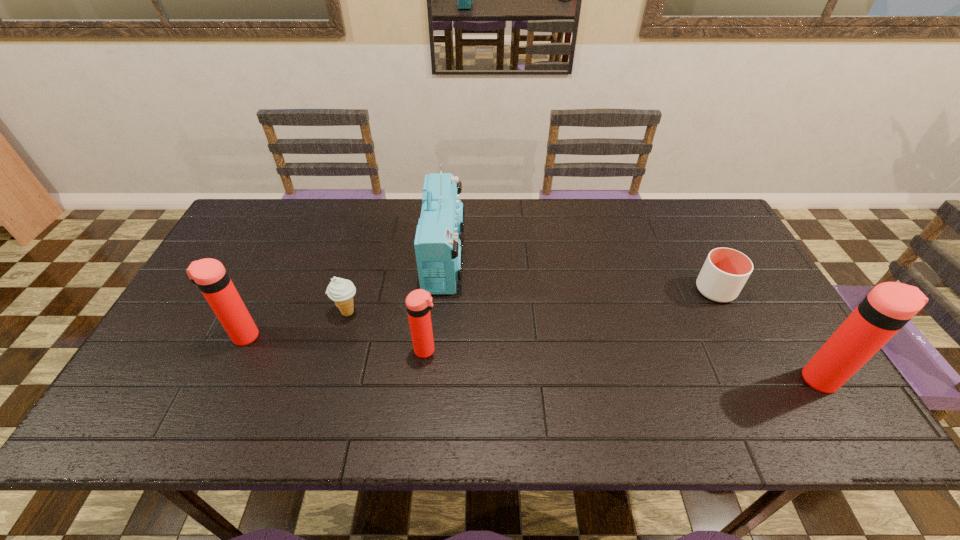
Where is `vacant space located 0.110m on the left of the leftmost object`? vacant space located 0.110m on the left of the leftmost object is located at coordinates (186, 336).

Identify the location of free point located on the front of the fourth tallest object. This screenshot has width=960, height=540. (423, 376).

Image resolution: width=960 pixels, height=540 pixels. I want to click on free space located 0.380m on the left of the tallest thermos bottle, so click(x=641, y=380).

Find the location of a particular element. free space located on the front of the second object from right to left is located at coordinates (732, 322).

Image resolution: width=960 pixels, height=540 pixels. I want to click on free spot located 0.170m on the front-facing side of the radio receiver, so click(x=519, y=257).

I want to click on free space located 0.120m on the back of the second object from left to right, so click(359, 272).

I want to click on object situated at the far edge, so click(x=438, y=249).

What are the coordinates of `object that is at the near edge` in the screenshot? It's located at (889, 306).

Find the location of `object that is at the left edge`. object that is at the left edge is located at coordinates (208, 274).

At what (x,y) coordinates should I click in order to perform the action: click on thermos bottle present at the right edge. Please return your answer as a coordinate pair (x, y). Looking at the image, I should click on (889, 306).